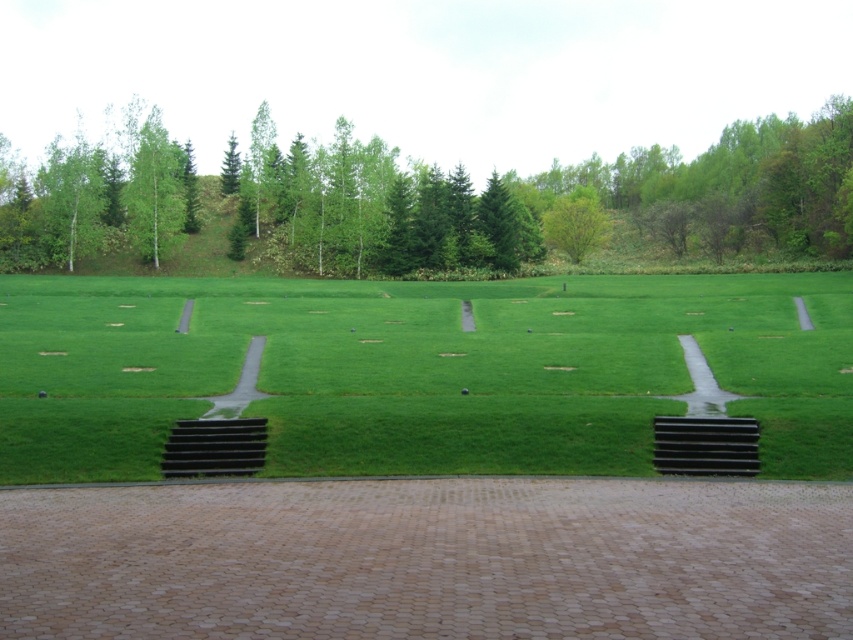
Can you confirm if green leafy tree at upper right is taller than green leafy tree at upper center?

Correct, green leafy tree at upper right is much taller as green leafy tree at upper center.

Between green leafy tree at upper right and green leafy tree at upper center, which one appears on the left side from the viewer's perspective?

green leafy tree at upper center

The width and height of the screenshot is (853, 640). What are the coordinates of `green leafy tree at upper right` in the screenshot? It's located at point(732,186).

Where is `green leafy tree at upper right`? The height and width of the screenshot is (640, 853). green leafy tree at upper right is located at coordinates (732, 186).

Does point (766, 228) lie behind point (74, 211)?

That is True.

Can you confirm if green leafy tree at upper right is positioned above green matte tree at upper left?

Indeed, green leafy tree at upper right is positioned over green matte tree at upper left.

Locate an element on the screen. This screenshot has width=853, height=640. green leafy tree at upper right is located at coordinates (732, 186).

Between point (421, 308) and point (671, 172), which one is positioned behind?

Point (671, 172)

Locate an element on the screen. The height and width of the screenshot is (640, 853). green grass at center is located at coordinates (418, 371).